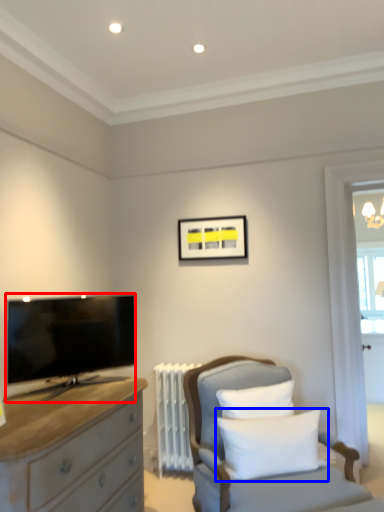
Question: Which of the following is the farthest to the observer, television (highlighted by a red box) or pillow (highlighted by a blue box)?

Choices:
 (A) television
 (B) pillow

Answer: (A)